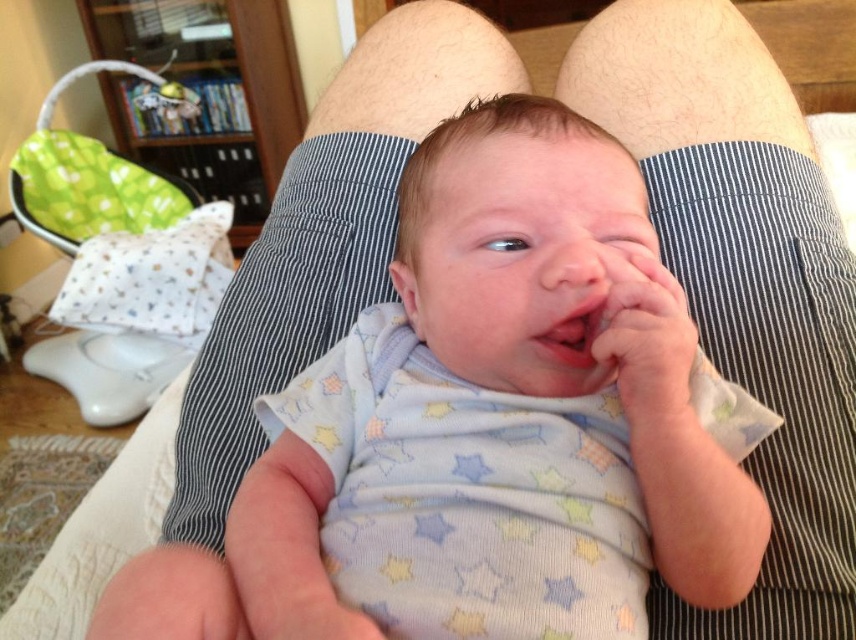
Is white soft fabric baby at center to the left of pink smooth lips at center from the viewer's perspective?

Yes, white soft fabric baby at center is to the left of pink smooth lips at center.

How much distance is there between white soft fabric baby at center and pink smooth lips at center?

white soft fabric baby at center is 12.42 centimeters from pink smooth lips at center.

Where is `white soft fabric baby at center`? white soft fabric baby at center is located at coordinates (485, 428).

Does smooth skin hand at center appear under pink smooth lips at center?

Yes, smooth skin hand at center is below pink smooth lips at center.

Between point (634, 280) and point (589, 312), which one is positioned behind?

Point (589, 312)

Image resolution: width=856 pixels, height=640 pixels. Identify the location of smooth skin hand at center. (646, 337).

Identify the location of smooth skin hand at center. (646, 337).

Between white soft fabric baby at center and smooth skin hand at center, which one is positioned lower?

white soft fabric baby at center is below.

Can you confirm if white soft fabric baby at center is positioned to the right of smooth skin hand at center?

Incorrect, white soft fabric baby at center is not on the right side of smooth skin hand at center.

This screenshot has height=640, width=856. Identify the location of white soft fabric baby at center. (485, 428).